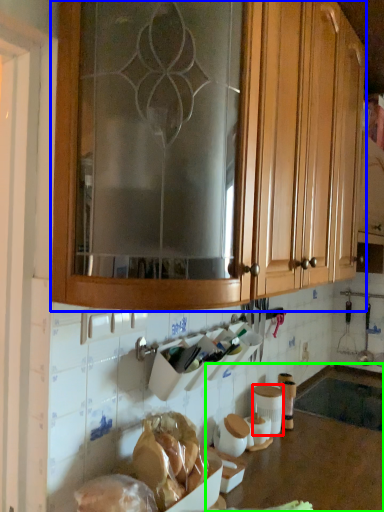
Question: Which object is positioned farthest from pottery (highlighted by a red box)? Select from cabinetry (highlighted by a blue box) and counter top (highlighted by a green box).

Choices:
 (A) cabinetry
 (B) counter top

Answer: (A)